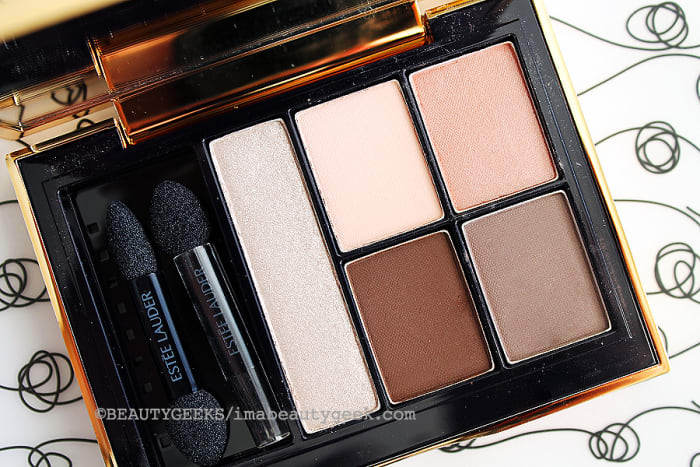
You are a GUI agent. You are given a task and a screenshot of the screen. Output one action in this format:
    pyautogui.click(x=<x>, y=<y>)
    Task: Click on the hinge for case
    
    Given the screenshot: What is the action you would take?
    pyautogui.click(x=192, y=69)